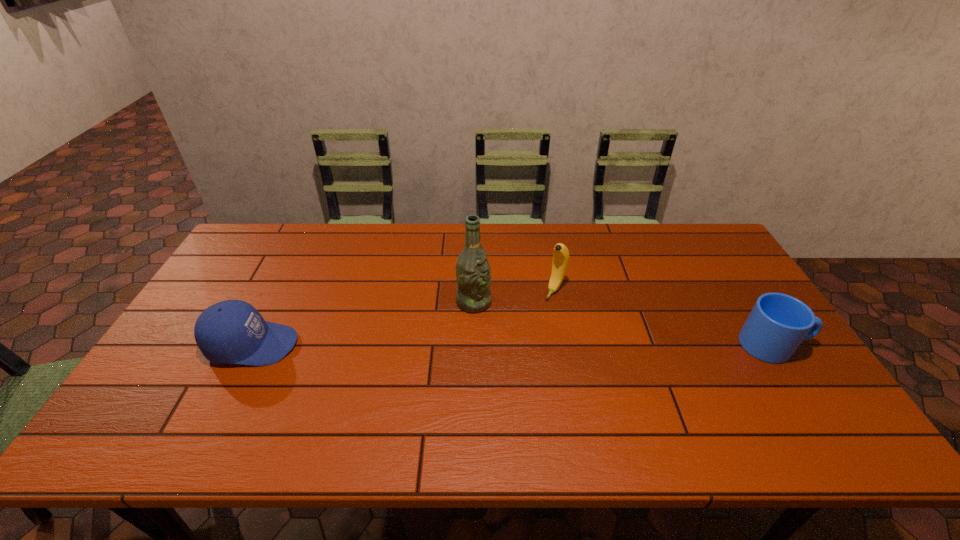
The height and width of the screenshot is (540, 960). I want to click on free space on the desktop that is between the cap and the mug and is positioned from the stem of the banana, so click(515, 345).

Locate an element on the screen. This screenshot has height=540, width=960. vacant spot on the desktop that is between the leftmost object and the rightmost object and is positioned on the surface of the beer bottle is located at coordinates (570, 345).